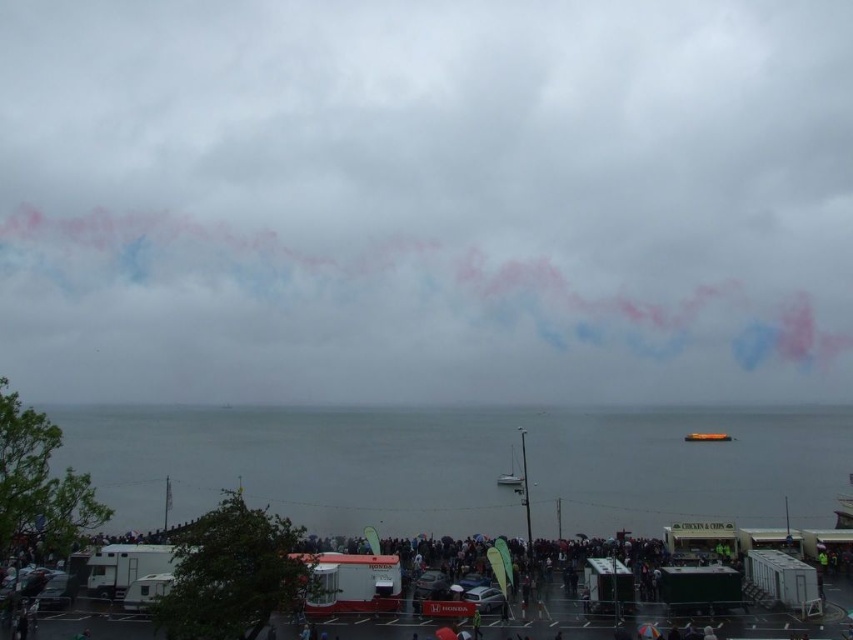
Question: Is pink smoke at upper center further to camera compared to gray water at lower center?

Choices:
 (A) no
 (B) yes

Answer: (B)

Question: Can you confirm if pink smoke at upper center is wider than gray water at lower center?

Choices:
 (A) yes
 (B) no

Answer: (A)

Question: Which point is farther to the camera?

Choices:
 (A) pink smoke at upper center
 (B) gray water at lower center

Answer: (A)

Question: Considering the relative positions of pink smoke at upper center and gray water at lower center in the image provided, where is pink smoke at upper center located with respect to gray water at lower center?

Choices:
 (A) below
 (B) above

Answer: (B)

Question: Which object appears farthest from the camera in this image?

Choices:
 (A) gray water at lower center
 (B) pink smoke at upper center

Answer: (B)